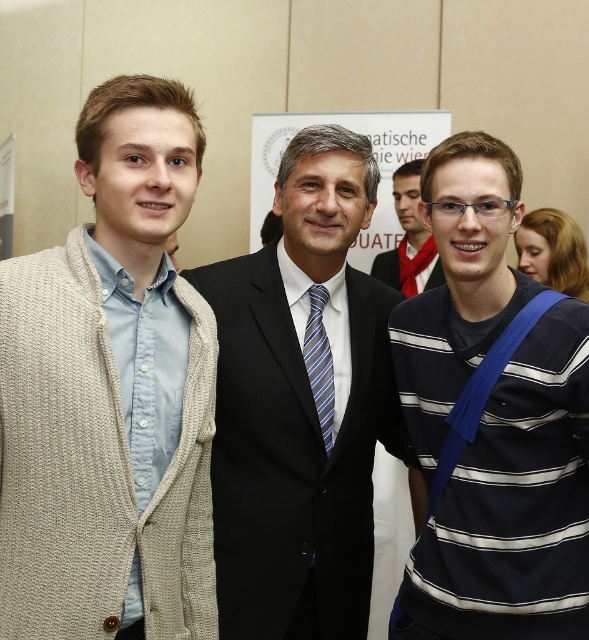
Based on the photo, you are a photographer adjusting the lighting for the subjects in the center. The blue striped tie at center and the dark blue textured suit at center are both in your focus area. Which of these two items requires more careful adjustment to avoid glare, considering their width?

The blue striped tie at center is thinner than the dark blue textured suit at center, so the blue striped tie at center requires more careful adjustment to avoid glare since it has a narrower surface area.

You are a photographer adjusting your camera settings. You want to focus on the beige knitted cardigan at left. Given that the camera has a depth of field range of 3 feet, will the cardigan be in focus?

The beige knitted cardigan at left is 3.85 feet away from the camera. Since the depth of field range is 3 feet, the cardigan is slightly out of the focus range. Therefore, it may not be in focus unless adjustments are made.

You are a photographer adjusting your camera settings to focus on the blue striped tie at center and the dark blue textured suit at center. Which object should you focus on first to ensure proper depth of field?

The blue striped tie at center is closer to the viewer than the dark blue textured suit at center, so you should focus on the blue striped tie at center first to ensure proper depth of field.